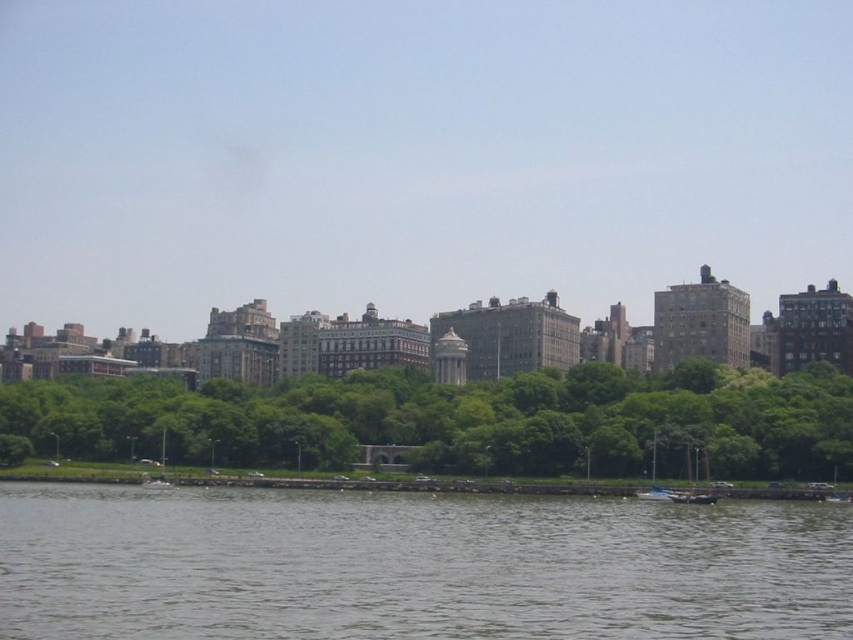
Based on the photo, does green leafy trees at center have a lesser height compared to white glossy boat at lower right?

In fact, green leafy trees at center may be taller than white glossy boat at lower right.

Is green leafy trees at center positioned at the back of white glossy boat at lower right?

Yes, green leafy trees at center is behind white glossy boat at lower right.

Who is more forward, (48,385) or (666,496)?

Positioned in front is point (666,496).

The height and width of the screenshot is (640, 853). In order to click on green leafy trees at center in this screenshot , I will do `click(460, 420)`.

Can you confirm if gray water at lower center is wider than white glossy boat at lower right?

Yes, gray water at lower center is wider than white glossy boat at lower right.

I want to click on gray water at lower center, so click(x=415, y=566).

Locate an element on the screen. gray water at lower center is located at coordinates (415, 566).

In the scene shown: Between gray water at lower center and wooden boat at lower right, which one is positioned higher?

Positioned higher is wooden boat at lower right.

Describe the element at coordinates (415, 566) in the screenshot. I see `gray water at lower center` at that location.

Is point (492, 557) closer to camera compared to point (697, 448)?

Yes, it is.

At what (x,y) coordinates should I click in order to perform the action: click on gray water at lower center. Please return your answer as a coordinate pair (x, y). Looking at the image, I should click on (415, 566).